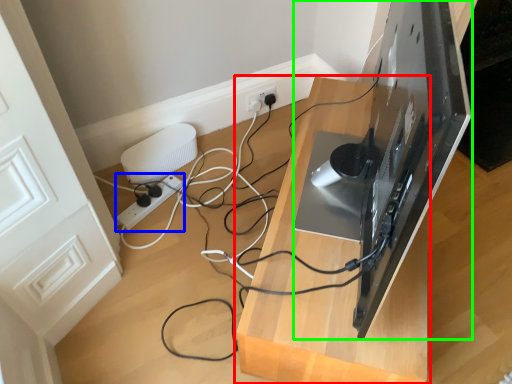
Question: Estimate the real-world distances between objects in this image. Which object is closer to furniture (highlighted by a red box), extension cord (highlighted by a blue box) or desktop computer (highlighted by a green box)?

Choices:
 (A) extension cord
 (B) desktop computer

Answer: (B)